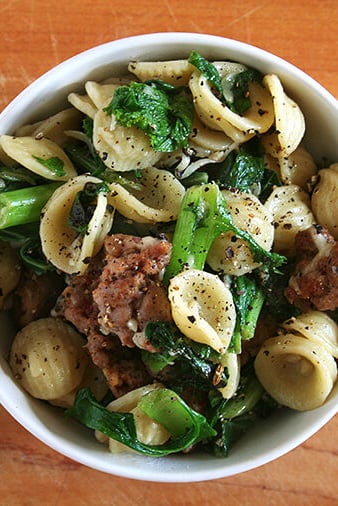
This screenshot has width=338, height=506. In order to click on 1 white bowl centered in this screenshot , I will do `click(250, 449)`.